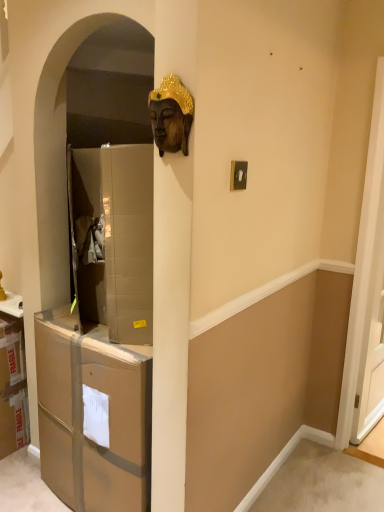
Question: Is the position of white glossy screen door at right more distant than that of brown cardboard drawer at left?

Choices:
 (A) yes
 (B) no

Answer: (A)

Question: From a real-world perspective, is white glossy screen door at right physically above brown cardboard drawer at left?

Choices:
 (A) no
 (B) yes

Answer: (B)

Question: Is white glossy screen door at right aimed at brown cardboard drawer at left?

Choices:
 (A) no
 (B) yes

Answer: (A)

Question: Does white glossy screen door at right contain brown cardboard drawer at left?

Choices:
 (A) no
 (B) yes

Answer: (A)

Question: Is white glossy screen door at right shorter than brown cardboard drawer at left?

Choices:
 (A) no
 (B) yes

Answer: (A)

Question: Are white glossy screen door at right and brown cardboard drawer at left making contact?

Choices:
 (A) yes
 (B) no

Answer: (B)

Question: Is brown cardboard drawer at left aimed at bronze statue at upper center?

Choices:
 (A) no
 (B) yes

Answer: (A)

Question: Does brown cardboard drawer at left have a smaller size compared to bronze statue at upper center?

Choices:
 (A) yes
 (B) no

Answer: (B)

Question: From a real-world perspective, is brown cardboard drawer at left positioned over bronze statue at upper center based on gravity?

Choices:
 (A) no
 (B) yes

Answer: (A)

Question: From the image's perspective, is brown cardboard drawer at left below bronze statue at upper center?

Choices:
 (A) yes
 (B) no

Answer: (A)

Question: Is brown cardboard drawer at left oriented away from bronze statue at upper center?

Choices:
 (A) no
 (B) yes

Answer: (A)

Question: From the image's perspective, is brown cardboard drawer at left on top of bronze statue at upper center?

Choices:
 (A) yes
 (B) no

Answer: (B)

Question: Is bronze statue at upper center at the right side of brown cardboard drawer at left?

Choices:
 (A) no
 (B) yes

Answer: (B)